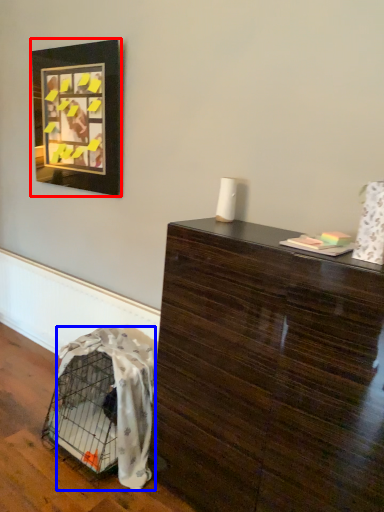
Question: Which object is closer to the camera taking this photo, picture frame (highlighted by a red box) or blanket (highlighted by a blue box)?

Choices:
 (A) picture frame
 (B) blanket

Answer: (B)